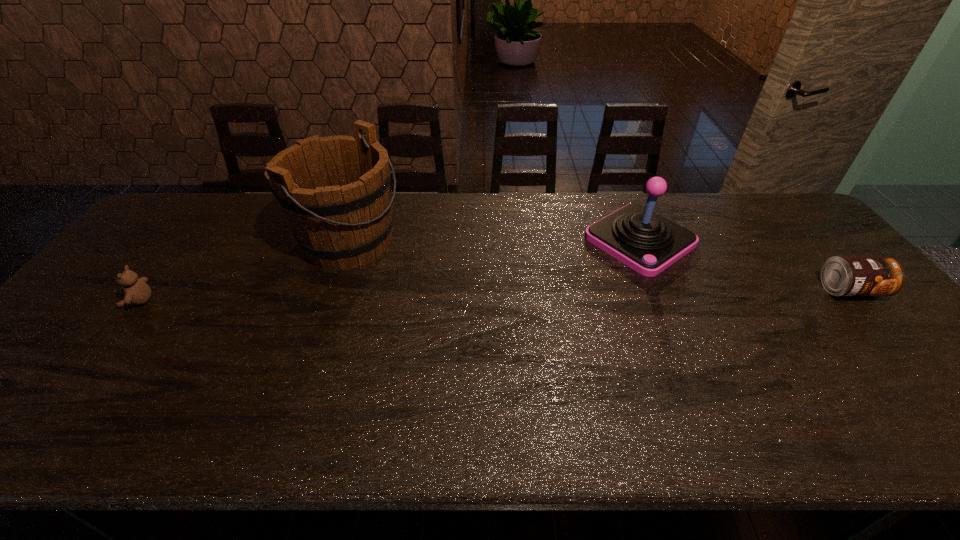
Locate an element on the screen. The image size is (960, 540). vacant space at the right edge is located at coordinates (795, 251).

In the image, there is a desktop. Identify the location of free space at the far right corner. The image size is (960, 540). point(790,212).

The height and width of the screenshot is (540, 960). Find the location of `free space at the near right corner of the desktop`. free space at the near right corner of the desktop is located at coordinates (948, 379).

Find the location of a particular element. free space between the tallest object and the joystick is located at coordinates point(494,241).

At what (x,y) coordinates should I click in order to perform the action: click on blank region between the teddy bear and the rightmost object. Please return your answer as a coordinate pair (x, y). The width and height of the screenshot is (960, 540). Looking at the image, I should click on (493, 296).

Locate an element on the screen. empty space that is in between the third object from right to left and the rightmost object is located at coordinates (599, 266).

Where is `free point between the can and the second object from right to left`? free point between the can and the second object from right to left is located at coordinates (745, 265).

Locate an element on the screen. free area in between the rightmost object and the third object from left to right is located at coordinates (745, 265).

What are the coordinates of `vacant space that is in between the rightmost object and the joystick` in the screenshot? It's located at (745, 265).

Where is `free space that is in between the tallest object and the rightmost object`? This screenshot has width=960, height=540. free space that is in between the tallest object and the rightmost object is located at coordinates (599, 266).